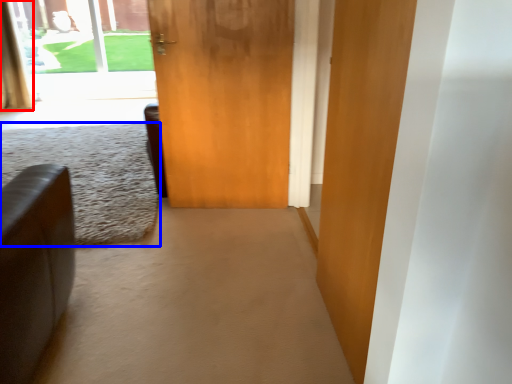
Question: Which of the following is the closest to the observer, curtain (highlighted by a red box) or plain (highlighted by a blue box)?

Choices:
 (A) curtain
 (B) plain

Answer: (B)